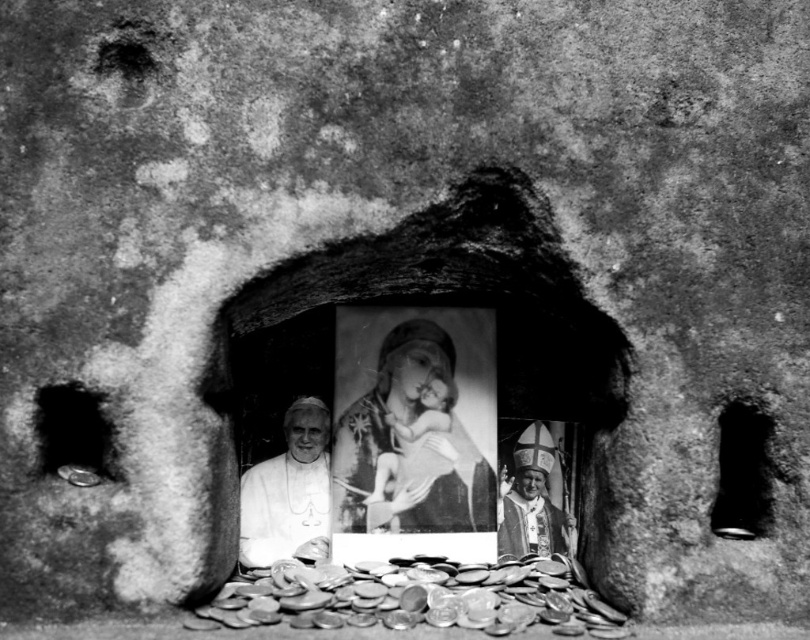
Is shiny metallic coins at lower center to the right of metallic coin at left from the viewer's perspective?

Indeed, shiny metallic coins at lower center is positioned on the right side of metallic coin at left.

Locate an element on the screen. Image resolution: width=810 pixels, height=640 pixels. shiny metallic coins at lower center is located at coordinates (416, 596).

Is point (514, 604) farther from camera compared to point (71, 433)?

Yes, it is.

At what (x,y) coordinates should I click in order to perform the action: click on shiny metallic coins at lower center. Please return your answer as a coordinate pair (x, y). This screenshot has height=640, width=810. Looking at the image, I should click on tap(416, 596).

Which is more to the left, shiny metallic coins at lower center or smooth painted canvas at center?

Positioned to the left is shiny metallic coins at lower center.

Between shiny metallic coins at lower center and smooth painted canvas at center, which one is positioned lower?

Positioned lower is shiny metallic coins at lower center.

This screenshot has width=810, height=640. Describe the element at coordinates (416, 596) in the screenshot. I see `shiny metallic coins at lower center` at that location.

Identify the location of shiny metallic coins at lower center. The height and width of the screenshot is (640, 810). (416, 596).

Is shiny metallic coins at lower center bigger than white matte portrait at center?

Yes, shiny metallic coins at lower center is bigger than white matte portrait at center.

Can you confirm if shiny metallic coins at lower center is taller than white matte portrait at center?

No.

Who is more distant from viewer, (480, 621) or (318, 499)?

The point (318, 499) is behind.

This screenshot has height=640, width=810. Find the location of `shiny metallic coins at lower center`. shiny metallic coins at lower center is located at coordinates (416, 596).